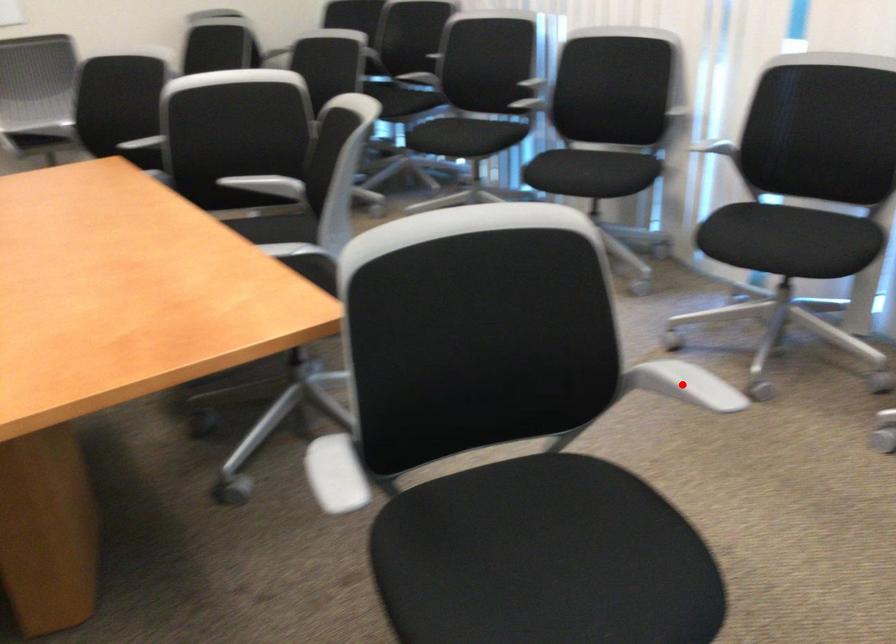
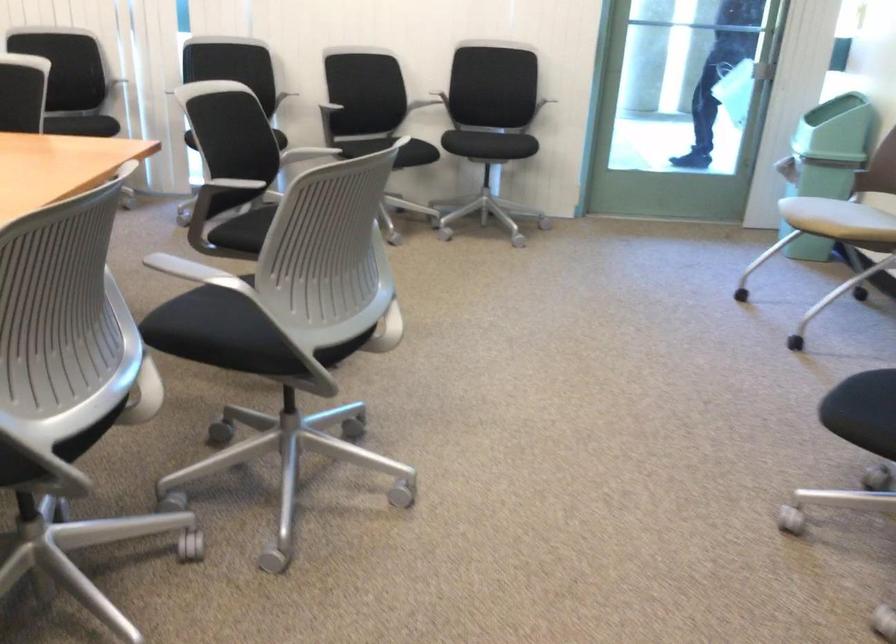
Question: I am providing you with two images of the same scene from different viewpoints. A red point is marked on the first image. Is the red point's position out of view in image 2?

Choices:
 (A) Yes
 (B) No

Answer: (A)